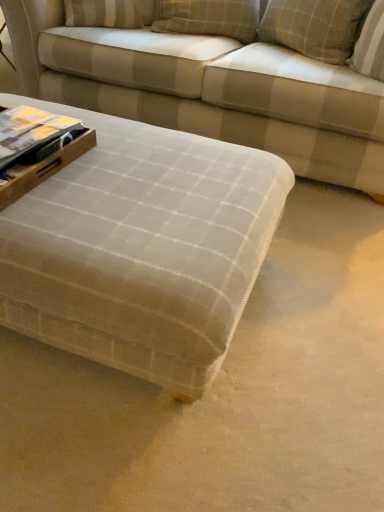
In order to face plaid fabric pillow at upper right, positioned as the second pillow in left-to-right order, should I rotate leftwards or rightwards?

Rotate your view right by about 15.695°.

The width and height of the screenshot is (384, 512). Describe the element at coordinates (314, 27) in the screenshot. I see `plaid fabric pillow at upper right, positioned as the second pillow in left-to-right order` at that location.

The image size is (384, 512). What do you see at coordinates (141, 249) in the screenshot? I see `textured beige ottoman at center` at bounding box center [141, 249].

Where is `plaid fabric pillow at upper center, which ranks as the second pillow in right-to-left order`? The width and height of the screenshot is (384, 512). plaid fabric pillow at upper center, which ranks as the second pillow in right-to-left order is located at coordinates (208, 18).

Locate an element on the screen. The image size is (384, 512). plaid fabric pillow at upper right, positioned as the second pillow in left-to-right order is located at coordinates (314, 27).

Would you say textured beige ottoman at center is part of matte paper book at left's contents?

No, textured beige ottoman at center is not inside matte paper book at left.

Is matte paper book at left touching textured beige ottoman at center?

No, matte paper book at left is not touching textured beige ottoman at center.

From a real-world perspective, is matte paper book at left positioned under textured beige ottoman at center based on gravity?

No, from a real-world perspective, matte paper book at left is not below textured beige ottoman at center.

Which point is more distant from viewer, (9,148) or (192,295)?

Point (9,148)

Is point (264, 40) positioned before point (243, 34)?

Yes.

How much distance is there between plaid fabric pillow at upper right, positioned as the second pillow in left-to-right order, and plaid fabric pillow at upper center, the first pillow when ordered from left to right?

A distance of 10.49 inches exists between plaid fabric pillow at upper right, positioned as the second pillow in left-to-right order, and plaid fabric pillow at upper center, the first pillow when ordered from left to right.

Between plaid fabric pillow at upper right, which ranks as the first pillow in right-to-left order, and plaid fabric pillow at upper center, which ranks as the second pillow in right-to-left order, which one has smaller size?

Smaller between the two is plaid fabric pillow at upper center, which ranks as the second pillow in right-to-left order.

Is plaid fabric pillow at upper right, which ranks as the first pillow in right-to-left order, to the left or to the right of plaid fabric pillow at upper center, which ranks as the second pillow in right-to-left order, in the image?

Clearly, plaid fabric pillow at upper right, which ranks as the first pillow in right-to-left order, is on the right of plaid fabric pillow at upper center, which ranks as the second pillow in right-to-left order, in the image.

Can you tell me how much plaid fabric pillow at upper center, the first pillow when ordered from left to right, and plaid fabric pillow at upper right, which ranks as the first pillow in right-to-left order, differ in facing direction?

plaid fabric pillow at upper center, the first pillow when ordered from left to right, and plaid fabric pillow at upper right, which ranks as the first pillow in right-to-left order, are facing 69.6 degrees away from each other.

Looking at this image, who is more distant, plaid fabric pillow at upper center, the first pillow when ordered from left to right, or plaid fabric pillow at upper right, positioned as the second pillow in left-to-right order?

Positioned behind is plaid fabric pillow at upper center, the first pillow when ordered from left to right.

Which of these two, plaid fabric pillow at upper center, the first pillow when ordered from left to right, or plaid fabric pillow at upper right, positioned as the second pillow in left-to-right order, is smaller?

With smaller size is plaid fabric pillow at upper center, the first pillow when ordered from left to right.

Is the position of textured beige fabric couch at center less distant than that of plaid fabric pillow at upper center, the first pillow when ordered from left to right?

That is True.

Does textured beige fabric couch at center have a smaller size compared to plaid fabric pillow at upper center, the first pillow when ordered from left to right?

Actually, textured beige fabric couch at center might be larger than plaid fabric pillow at upper center, the first pillow when ordered from left to right.

From the image's perspective, which pillow is the 2nd one above the textured beige fabric couch at center? Please provide its 2D coordinates.

[(208, 18)]

Which of these two, textured beige ottoman at center or plaid fabric pillow at upper right, positioned as the second pillow in left-to-right order, stands shorter?

With less height is plaid fabric pillow at upper right, positioned as the second pillow in left-to-right order.

Can you confirm if textured beige ottoman at center is wider than plaid fabric pillow at upper right, positioned as the second pillow in left-to-right order?

Yes.

Looking at this image, how far apart are textured beige ottoman at center and plaid fabric pillow at upper right, positioned as the second pillow in left-to-right order?

The distance of textured beige ottoman at center from plaid fabric pillow at upper right, positioned as the second pillow in left-to-right order, is 1.21 meters.

Is textured beige ottoman at center looking in the opposite direction of plaid fabric pillow at upper right, positioned as the second pillow in left-to-right order?

Yes.

Locate an element on the screen. pillow on the right of the textured beige fabric couch at center is located at coordinates (314, 27).

Is point (340, 39) closer or farther from the camera than point (297, 47)?

Point (340, 39).

Which of these two, textured beige fabric couch at center or plaid fabric pillow at upper right, which ranks as the first pillow in right-to-left order, is smaller?

A: With smaller size is plaid fabric pillow at upper right, which ranks as the first pillow in right-to-left order.

Visually, is textured beige fabric couch at center positioned to the left or to the right of plaid fabric pillow at upper right, which ranks as the first pillow in right-to-left order?

textured beige fabric couch at center is to the left of plaid fabric pillow at upper right, which ranks as the first pillow in right-to-left order.

Looking at this image, does textured beige ottoman at center have a greater width compared to matte paper book at left?

Indeed, textured beige ottoman at center has a greater width compared to matte paper book at left.

Considering the relative positions of textured beige ottoman at center and matte paper book at left in the image provided, is textured beige ottoman at center to the left or to the right of matte paper book at left?

textured beige ottoman at center is to the right of matte paper book at left.

From the picture: Is textured beige ottoman at center smaller than matte paper book at left?

No, textured beige ottoman at center is not smaller than matte paper book at left.

From the image's perspective, between textured beige ottoman at center and matte paper book at left, which one is located above?

matte paper book at left, from the image's perspective.

Find the location of a particular element. Image resolution: width=384 pixels, height=512 pixels. table to the right of matte paper book at left is located at coordinates (141, 249).

Find the location of a particular element. This screenshot has height=512, width=384. pillow on the left of plaid fabric pillow at upper right, positioned as the second pillow in left-to-right order is located at coordinates (208, 18).

Estimate the real-world distances between objects in this image. Which object is closer to textured beige fabric couch at center, plaid fabric pillow at upper right, positioned as the second pillow in left-to-right order, or textured beige ottoman at center?

plaid fabric pillow at upper right, positioned as the second pillow in left-to-right order, is positioned closer to the anchor textured beige fabric couch at center.

Based on their spatial positions, is textured beige fabric couch at center or plaid fabric pillow at upper center, which ranks as the second pillow in right-to-left order, closer to plaid fabric pillow at upper right, which ranks as the first pillow in right-to-left order?

plaid fabric pillow at upper center, which ranks as the second pillow in right-to-left order.

Estimate the real-world distances between objects in this image. Which object is further from matte paper book at left, plaid fabric pillow at upper right, which ranks as the first pillow in right-to-left order, or plaid fabric pillow at upper center, which ranks as the second pillow in right-to-left order?

plaid fabric pillow at upper right, which ranks as the first pillow in right-to-left order.

Considering their positions, is textured beige fabric couch at center positioned closer to plaid fabric pillow at upper right, which ranks as the first pillow in right-to-left order, than matte paper book at left?

textured beige fabric couch at center.

Looking at this image, which object lies further to the anchor point plaid fabric pillow at upper right, which ranks as the first pillow in right-to-left order, matte paper book at left or textured beige fabric couch at center?

matte paper book at left lies further to plaid fabric pillow at upper right, which ranks as the first pillow in right-to-left order, than the other object.

Estimate the real-world distances between objects in this image. Which object is further from plaid fabric pillow at upper center, the first pillow when ordered from left to right, matte paper book at left or plaid fabric pillow at upper right, which ranks as the first pillow in right-to-left order?

matte paper book at left is further to plaid fabric pillow at upper center, the first pillow when ordered from left to right.

Based on their spatial positions, is plaid fabric pillow at upper right, positioned as the second pillow in left-to-right order, or textured beige fabric couch at center further from plaid fabric pillow at upper center, the first pillow when ordered from left to right?

The object further to plaid fabric pillow at upper center, the first pillow when ordered from left to right, is textured beige fabric couch at center.

When comparing their distances from matte paper book at left, does textured beige ottoman at center or textured beige fabric couch at center seem further?

Among the two, textured beige fabric couch at center is located further to matte paper book at left.

Locate an element on the screen. This screenshot has width=384, height=512. book between textured beige fabric couch at center and textured beige ottoman at center vertically is located at coordinates (30, 131).

Where is `pillow between textured beige fabric couch at center and plaid fabric pillow at upper center, the first pillow when ordered from left to right, in the front-back direction`? The image size is (384, 512). pillow between textured beige fabric couch at center and plaid fabric pillow at upper center, the first pillow when ordered from left to right, in the front-back direction is located at coordinates (314, 27).

The image size is (384, 512). I want to click on pillow between matte paper book at left and plaid fabric pillow at upper right, which ranks as the first pillow in right-to-left order, so click(208, 18).

You are a GUI agent. You are given a task and a screenshot of the screen. Output one action in this format:
    pyautogui.click(x=<x>, y=<y>)
    Task: Click on the table between matte paper book at left and plaid fabric pillow at upper right, which ranks as the first pillow in right-to-left order, from left to right
    
    Given the screenshot: What is the action you would take?
    pyautogui.click(x=141, y=249)